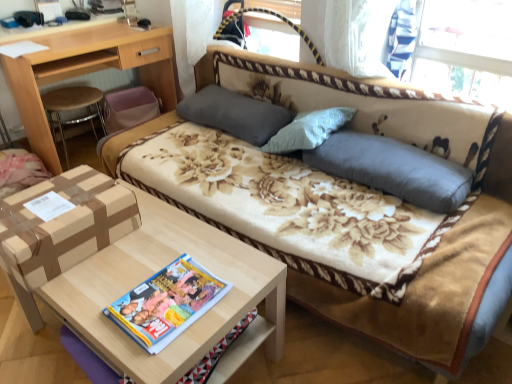
Where is `free point above light brown wood table at lower left (from a real-world perspective)`? The height and width of the screenshot is (384, 512). free point above light brown wood table at lower left (from a real-world perspective) is located at coordinates (151, 268).